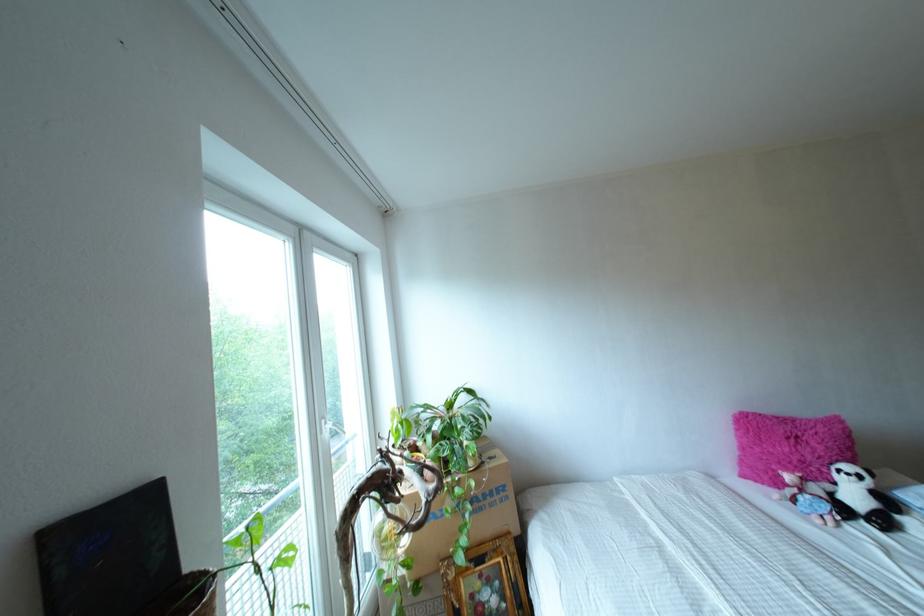
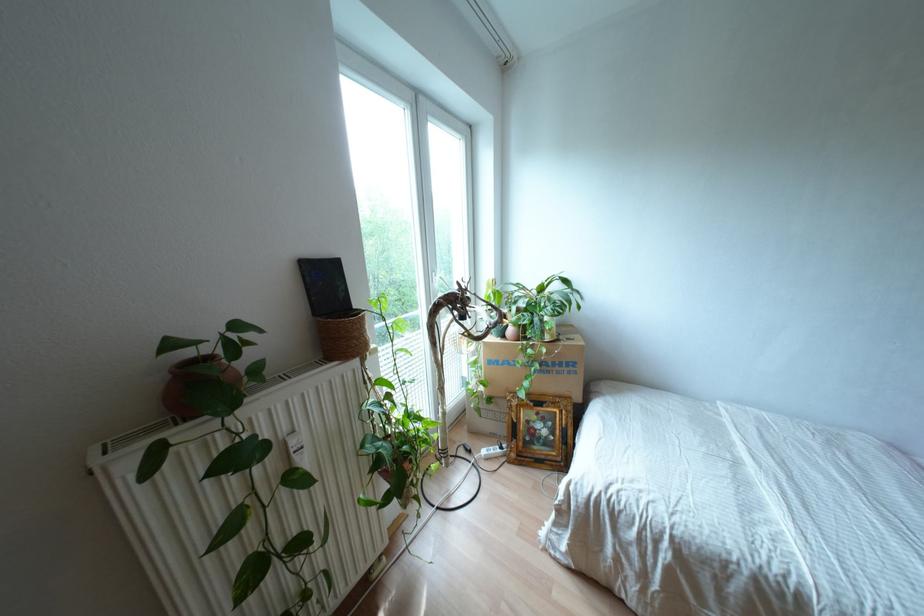
Question: I am providing you with two images of the same scene from different viewpoints. Please identify which objects are invisible in image2.

Choices:
 (A) cardboard box
 (B) pink plant pot
 (C) white electrical plug
 (D) none of these

Answer: (D)